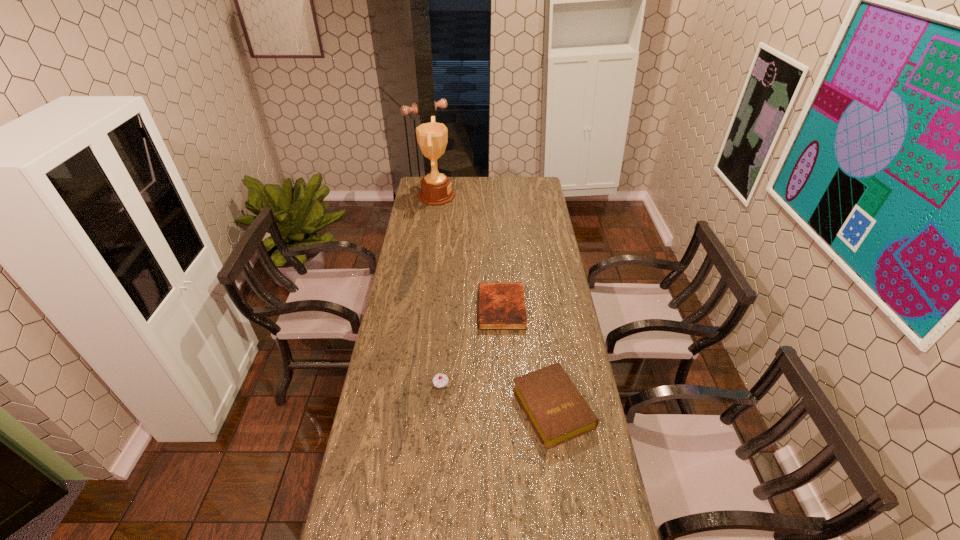
At what (x,y) coordinates should I click in order to perform the action: click on vacant area that lies between the cupcake and the shortest object. Please return your answer as a coordinate pair (x, y). The width and height of the screenshot is (960, 540). Looking at the image, I should click on (471, 347).

Where is `object that is the nearest to the cupcake`? object that is the nearest to the cupcake is located at coordinates (556, 409).

You are a GUI agent. You are given a task and a screenshot of the screen. Output one action in this format:
    pyautogui.click(x=<x>, y=<y>)
    Task: Click on the closest object to the second tallest object
    This screenshot has width=960, height=540.
    Given the screenshot: What is the action you would take?
    click(556, 409)

This screenshot has height=540, width=960. Identify the location of vacant area in the image that satisfies the following two spatial constraints: 1. on the spine side of the shortest object; 2. on the right side of the taller Bible. (507, 408).

In order to click on free space that satisfies the following two spatial constraints: 1. on the spine side of the shorter Bible; 2. on the front side of the cupcake in this screenshot , I will do `click(505, 386)`.

Where is `vacant area that satisfies the following two spatial constraints: 1. on the front-facing side of the farthest object; 2. on the right side of the nearer Bible`? The width and height of the screenshot is (960, 540). vacant area that satisfies the following two spatial constraints: 1. on the front-facing side of the farthest object; 2. on the right side of the nearer Bible is located at coordinates (406, 408).

Locate an element on the screen. vacant region that satisfies the following two spatial constraints: 1. on the front-facing side of the tallest object; 2. on the back side of the cupcake is located at coordinates (409, 386).

The height and width of the screenshot is (540, 960). I want to click on free space that satisfies the following two spatial constraints: 1. on the spine side of the second farthest object; 2. on the back side of the nearer Bible, so [507, 408].

Image resolution: width=960 pixels, height=540 pixels. What are the coordinates of `vacant space that satisfies the following two spatial constraints: 1. on the spine side of the taller Bible; 2. on the right side of the shorter Bible` in the screenshot? It's located at (507, 408).

Find the location of a particular element. free space that satisfies the following two spatial constraints: 1. on the front-facing side of the farthest object; 2. on the left side of the taller Bible is located at coordinates (406, 408).